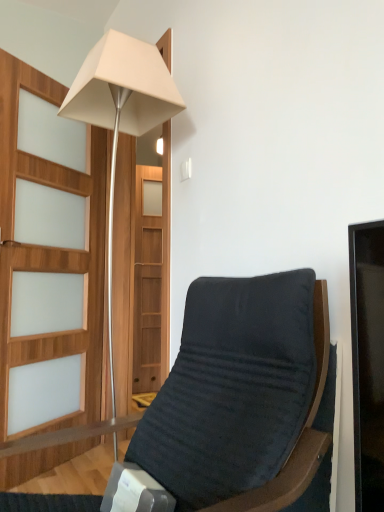
Where is `matte white lamp at upper left`? This screenshot has height=512, width=384. matte white lamp at upper left is located at coordinates (121, 110).

Image resolution: width=384 pixels, height=512 pixels. What do you see at coordinates (121, 110) in the screenshot? I see `matte white lamp at upper left` at bounding box center [121, 110].

Identify the location of velvet-like dark gray chair at center. This screenshot has width=384, height=512. (223, 406).

This screenshot has width=384, height=512. Describe the element at coordinates (223, 406) in the screenshot. I see `velvet-like dark gray chair at center` at that location.

The width and height of the screenshot is (384, 512). What are the coordinates of `matte white lamp at upper left` in the screenshot? It's located at (121, 110).

Would you say velvet-like dark gray chair at center is to the left or to the right of matte white lamp at upper left in the picture?

From the image, it's evident that velvet-like dark gray chair at center is to the right of matte white lamp at upper left.

Which is behind, velvet-like dark gray chair at center or matte white lamp at upper left?

matte white lamp at upper left is further away from the camera.

Which point is more distant from viewer, [297,302] or [108,65]?

The point [108,65] is farther from the camera.

From the image's perspective, which object appears higher, velvet-like dark gray chair at center or matte white lamp at upper left?

matte white lamp at upper left is shown above in the image.

From a real-world perspective, which is physically above, velvet-like dark gray chair at center or matte white lamp at upper left?

matte white lamp at upper left, from a real-world perspective.

Does velvet-like dark gray chair at center have a lesser width compared to matte white lamp at upper left?

No, velvet-like dark gray chair at center is not thinner than matte white lamp at upper left.

In the scene shown: Between velvet-like dark gray chair at center and matte white lamp at upper left, which one has less height?

With less height is velvet-like dark gray chair at center.

Between velvet-like dark gray chair at center and matte white lamp at upper left, which one has smaller size?

matte white lamp at upper left is smaller.

Which is correct: velvet-like dark gray chair at center is inside matte white lamp at upper left, or outside of it?

velvet-like dark gray chair at center is outside matte white lamp at upper left.

Is there a large distance between velvet-like dark gray chair at center and matte white lamp at upper left?

No, velvet-like dark gray chair at center is in close proximity to matte white lamp at upper left.

Is matte white lamp at upper left at the back of velvet-like dark gray chair at center?

No, velvet-like dark gray chair at center is not facing the opposite direction of matte white lamp at upper left.

In order to click on lamp located above the velvet-like dark gray chair at center (from a real-world perspective) in this screenshot , I will do `click(121, 110)`.

In the scene shown: Considering the positions of objects matte white lamp at upper left and velvet-like dark gray chair at center in the image provided, who is more to the right, matte white lamp at upper left or velvet-like dark gray chair at center?

From the viewer's perspective, velvet-like dark gray chair at center appears more on the right side.

From the picture: Considering their positions, is matte white lamp at upper left located in front of or behind velvet-like dark gray chair at center?

Visually, matte white lamp at upper left is located behind velvet-like dark gray chair at center.

Between point (111, 329) and point (289, 415), which one is positioned behind?

The point (111, 329) is behind.

From the image's perspective, does matte white lamp at upper left appear higher than velvet-like dark gray chair at center?

Yes.

From a real-world perspective, is matte white lamp at upper left physically located above or below velvet-like dark gray chair at center?

Clearly, from a real-world perspective, matte white lamp at upper left is above velvet-like dark gray chair at center.

Does matte white lamp at upper left have a lesser width compared to velvet-like dark gray chair at center?

Correct, the width of matte white lamp at upper left is less than that of velvet-like dark gray chair at center.

Which of these two, matte white lamp at upper left or velvet-like dark gray chair at center, stands shorter?

velvet-like dark gray chair at center.

In terms of size, does matte white lamp at upper left appear bigger or smaller than velvet-like dark gray chair at center?

Considering their sizes, matte white lamp at upper left takes up less space than velvet-like dark gray chair at center.

Is matte white lamp at upper left situated inside velvet-like dark gray chair at center or outside?

matte white lamp at upper left is spatially situated outside velvet-like dark gray chair at center.

Is matte white lamp at upper left beside velvet-like dark gray chair at center?

matte white lamp at upper left and velvet-like dark gray chair at center are clearly separated.

Is matte white lamp at upper left facing towards velvet-like dark gray chair at center?

No, matte white lamp at upper left is not facing towards velvet-like dark gray chair at center.

You are a GUI agent. You are given a task and a screenshot of the screen. Output one action in this format:
    pyautogui.click(x=<x>, y=<y>)
    Task: Click on the lamp above the velvet-like dark gray chair at center (from a real-world perspective)
    The image size is (384, 512).
    Given the screenshot: What is the action you would take?
    [121, 110]

This screenshot has width=384, height=512. I want to click on chair that is in front of the matte white lamp at upper left, so click(223, 406).

Locate an element on the screen. chair that appears below the matte white lamp at upper left (from a real-world perspective) is located at coordinates (223, 406).